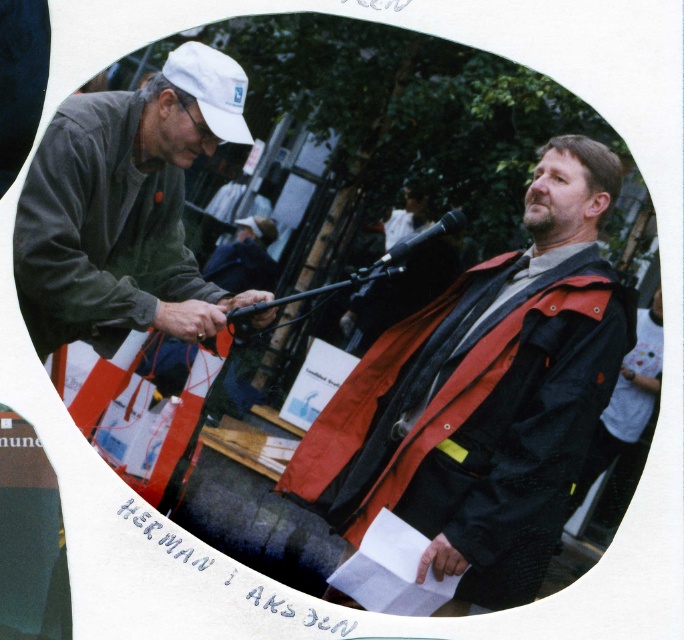
Question: Can you confirm if matte gray sweater at left is positioned above white matte cap at upper left?

Choices:
 (A) no
 (B) yes

Answer: (A)

Question: Can you confirm if orange fabric vest at right is positioned to the right of metallic black microphone at center?

Choices:
 (A) yes
 (B) no

Answer: (A)

Question: Can you confirm if matte black microphone at center is positioned to the left of smooth skin hand at lower center?

Choices:
 (A) no
 (B) yes

Answer: (B)

Question: Which point appears farthest from the camera in this image?

Choices:
 (A) (57, 310)
 (B) (657, 336)
 (C) (202, 77)

Answer: (C)

Question: Considering the real-world distances, which object is closest to the orange fabric vest at right?

Choices:
 (A) matte gray sweater at left
 (B) matte black microphone at center

Answer: (B)

Question: Which point is closer to the camera?

Choices:
 (A) (18, 288)
 (B) (218, 304)

Answer: (A)